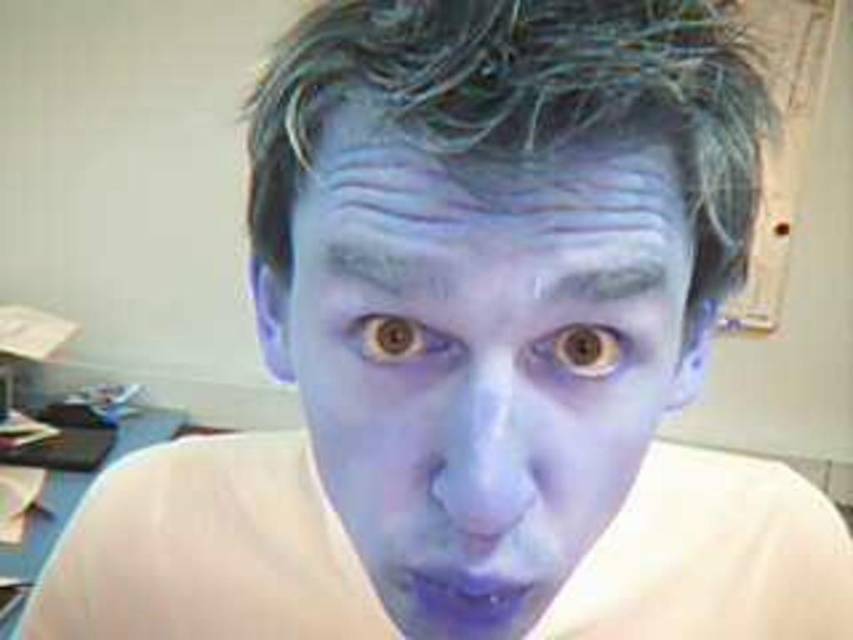
You are an artist trying to paint a portrait of the person in the image. You need to decide the order of painting the blue matte hair at center and the matte blue eyebrow at center based on their positions. Which should you paint first according to their spatial relationship?

The blue matte hair at center is closer to the viewer than the matte blue eyebrow at center, so you should paint the blue matte hair at center first to establish the foreground elements before moving to the background features.

You are an artist trying to recreate this portrait. You notice the blue matte hair at center and the brown shiny eye at center. Which object has a greater width in the image?

The blue matte hair at center has a greater width than the brown shiny eye at center.

Consider the image. You are a photographer trying to focus on the blue matte hair at center in the image. The camera shows a grid with a point at coordinate (526,99). Is this point the correct location to focus on the blue matte hair at center?

Yes, the point at (526,99) is the correct location to focus on the blue matte hair at center as it indicates that position.